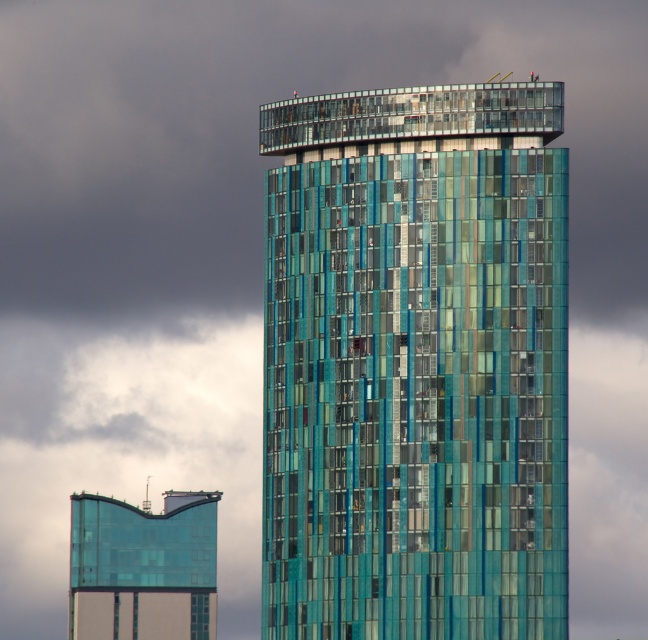
You are an architect evaluating the structural integrity of the buildings in the image. Considering the teal glass tower at center and the transparent glass tower at lower left, which one would have a wider base to support its structure?

The teal glass tower at center has a larger width than the transparent glass tower at lower left, so it would require a wider base to support its structure.

Based on the coordinates provided, which object corresponds to the point at [415,364]?

The teal glass tower at center corresponds to the point at [415,364].

You are standing at the center of the image and want to locate the teal glass tower at center. According to the coordinates provided, in which direction should you look to find it?

The teal glass tower at center is located at coordinates point (415, 364), so you should look slightly to the right and downward from the exact center of the image to locate it.